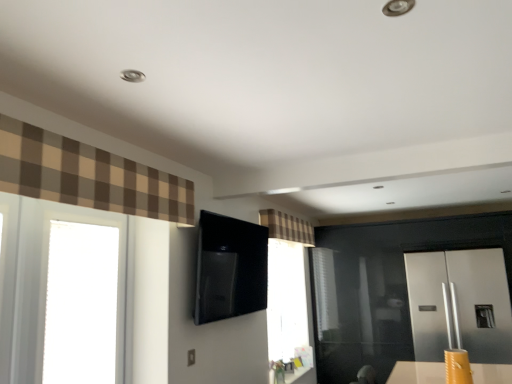
At what (x,y) coordinates should I click in order to perform the action: click on plaid fabric curtain at upper center, the first curtain in the right-to-left sequence. Please return your answer as a coordinate pair (x, y). The width and height of the screenshot is (512, 384). Looking at the image, I should click on (287, 227).

Find the location of a particular element. The width and height of the screenshot is (512, 384). matte black outlet at lower center is located at coordinates (191, 357).

What is the approximate width of brown plaid curtain at upper left, which is the second curtain in back-to-front order?

The width of brown plaid curtain at upper left, which is the second curtain in back-to-front order, is 6.51 inches.

You are a GUI agent. You are given a task and a screenshot of the screen. Output one action in this format:
    pyautogui.click(x=<x>, y=<y>)
    Task: Click on the transparent glass window at left
    Image resolution: width=512 pixels, height=384 pixels.
    Given the screenshot: What is the action you would take?
    pyautogui.click(x=81, y=304)

Based on the photo, considering the relative positions of transparent glass window at left and matte black outlet at lower center in the image provided, is transparent glass window at left to the left or to the right of matte black outlet at lower center?

Clearly, transparent glass window at left is on the left of matte black outlet at lower center in the image.

Is transparent glass window at left located outside matte black outlet at lower center?

Yes.

Looking at this image, from a real-world perspective, who is located lower, transparent glass window at left or matte black outlet at lower center?

From a 3D spatial view, matte black outlet at lower center is below.

Does transparent glass window at left appear on the left side of plaid fabric curtain at upper center, the first curtain in the right-to-left sequence?

Yes.

How many degrees apart are the facing directions of transparent glass window at left and plaid fabric curtain at upper center, placed as the first curtain when sorted from bottom to top?

They differ by 0.516 degrees in their facing directions.

Does transparent glass window at left lie behind plaid fabric curtain at upper center, acting as the second curtain starting from the top?

No, transparent glass window at left is closer to the viewer.

Can transparent glass window at left be found inside plaid fabric curtain at upper center, acting as the second curtain starting from the top?

No, plaid fabric curtain at upper center, acting as the second curtain starting from the top, does not contain transparent glass window at left.

Does plaid fabric curtain at upper center, acting as the second curtain starting from the top, lie in front of transparent glass window at left?

No, it is behind transparent glass window at left.

Can you confirm if plaid fabric curtain at upper center, acting as the second curtain starting from the top, is taller than transparent glass window at left?

Incorrect, the height of plaid fabric curtain at upper center, acting as the second curtain starting from the top, is not larger of that of transparent glass window at left.

Which object is positioned more to the left, plaid fabric curtain at upper center, the second curtain positioned from the left, or brown plaid curtain at upper left, which is counted as the first curtain, starting from the front?

From the viewer's perspective, brown plaid curtain at upper left, which is counted as the first curtain, starting from the front, appears more on the left side.

Does point (303, 240) lie behind point (85, 189)?

That is True.

Does plaid fabric curtain at upper center, the second curtain positioned from the left, contain brown plaid curtain at upper left, which is the second curtain in back-to-front order?

Actually, brown plaid curtain at upper left, which is the second curtain in back-to-front order, is outside plaid fabric curtain at upper center, the second curtain positioned from the left.

Where is `curtain below the plaid fabric curtain at upper center, the first curtain in the right-to-left sequence (from a real-world perspective)`? The height and width of the screenshot is (384, 512). curtain below the plaid fabric curtain at upper center, the first curtain in the right-to-left sequence (from a real-world perspective) is located at coordinates (87, 175).

Can you confirm if satin silver refrigerator at right is wider than plaid fabric curtain at upper center, placed as the first curtain when sorted from bottom to top?

Yes, satin silver refrigerator at right is wider than plaid fabric curtain at upper center, placed as the first curtain when sorted from bottom to top.

Is satin silver refrigerator at right next to plaid fabric curtain at upper center, the second curtain positioned from the left, and touching it?

No, satin silver refrigerator at right is not touching plaid fabric curtain at upper center, the second curtain positioned from the left.

Looking at this image, is satin silver refrigerator at right positioned beyond the bounds of plaid fabric curtain at upper center, the second curtain positioned from the left?

Yes, satin silver refrigerator at right is not within plaid fabric curtain at upper center, the second curtain positioned from the left.

How many degrees apart are the facing directions of satin silver refrigerator at right and plaid fabric curtain at upper center, which ranks as the first curtain in back-to-front order?

satin silver refrigerator at right and plaid fabric curtain at upper center, which ranks as the first curtain in back-to-front order, are facing 90.5 degrees away from each other.

Is matte black outlet at lower center facing towards brown plaid curtain at upper left, which is the second curtain in back-to-front order?

No, matte black outlet at lower center does not turn towards brown plaid curtain at upper left, which is the second curtain in back-to-front order.

In the scene shown: In terms of size, does matte black outlet at lower center appear bigger or smaller than brown plaid curtain at upper left, the first curtain viewed from the left?

matte black outlet at lower center is smaller than brown plaid curtain at upper left, the first curtain viewed from the left.

This screenshot has height=384, width=512. I want to click on electric outlet behind the brown plaid curtain at upper left, the first curtain viewed from the top, so click(x=191, y=357).

Could you tell me if brown plaid curtain at upper left, the first curtain viewed from the top, is turned towards plaid fabric curtain at upper center, which ranks as the first curtain in back-to-front order?

No, brown plaid curtain at upper left, the first curtain viewed from the top, is not turned towards plaid fabric curtain at upper center, which ranks as the first curtain in back-to-front order.

Is brown plaid curtain at upper left, which ranks as the second curtain in bottom-to-top order, wider than plaid fabric curtain at upper center, the first curtain in the right-to-left sequence?

In fact, brown plaid curtain at upper left, which ranks as the second curtain in bottom-to-top order, might be narrower than plaid fabric curtain at upper center, the first curtain in the right-to-left sequence.

From the picture: Is brown plaid curtain at upper left, the first curtain viewed from the top, next to plaid fabric curtain at upper center, acting as the second curtain starting from the top, and touching it?

A: No.

Who is taller, brown plaid curtain at upper left, which ranks as the second curtain in bottom-to-top order, or plaid fabric curtain at upper center, placed as the second curtain when sorted from front to back?

With more height is plaid fabric curtain at upper center, placed as the second curtain when sorted from front to back.

This screenshot has height=384, width=512. In the image, there is a transparent glass window at left. Identify the location of electric outlet below it (from the image's perspective). (191, 357).

Locate an element on the screen. This screenshot has height=384, width=512. curtain behind the transparent glass window at left is located at coordinates (287, 227).

Estimate the real-world distances between objects in this image. Which object is further from matte black outlet at lower center, transparent glass window at left or brown plaid curtain at upper left, the first curtain viewed from the top?

brown plaid curtain at upper left, the first curtain viewed from the top, is further to matte black outlet at lower center.

Considering their positions, is plaid fabric curtain at upper center, the first curtain in the right-to-left sequence, positioned further to brown plaid curtain at upper left, which is the 2th curtain in right-to-left order, than satin silver refrigerator at right?

Among the two, satin silver refrigerator at right is located further to brown plaid curtain at upper left, which is the 2th curtain in right-to-left order.

Looking at the image, which one is located closer to plaid fabric curtain at upper center, placed as the first curtain when sorted from bottom to top, brown plaid curtain at upper left, the first curtain viewed from the top, or matte black outlet at lower center?

matte black outlet at lower center is positioned closer to the anchor plaid fabric curtain at upper center, placed as the first curtain when sorted from bottom to top.

Considering their positions, is transparent glass window at left positioned closer to brown plaid curtain at upper left, which is the 2th curtain in right-to-left order, than matte black outlet at lower center?

transparent glass window at left is positioned closer to the anchor brown plaid curtain at upper left, which is the 2th curtain in right-to-left order.

Looking at the image, which one is located closer to transparent glass window at left, matte black outlet at lower center or plaid fabric curtain at upper center, placed as the second curtain when sorted from front to back?

matte black outlet at lower center is closer to transparent glass window at left.

When comparing their distances from transparent glass window at left, does brown plaid curtain at upper left, the first curtain viewed from the left, or matte black outlet at lower center seem further?

matte black outlet at lower center is further to transparent glass window at left.

Based on their spatial positions, is plaid fabric curtain at upper center, placed as the second curtain when sorted from front to back, or satin silver refrigerator at right closer to matte black outlet at lower center?

plaid fabric curtain at upper center, placed as the second curtain when sorted from front to back.

When comparing their distances from transparent glass window at left, does plaid fabric curtain at upper center, the second curtain positioned from the left, or matte black outlet at lower center seem closer?

matte black outlet at lower center is closer to transparent glass window at left.

The width and height of the screenshot is (512, 384). In order to click on curtain between matte black outlet at lower center and satin silver refrigerator at right in this screenshot , I will do `click(287, 227)`.

At what (x,y) coordinates should I click in order to perform the action: click on electric outlet between transparent glass window at left and plaid fabric curtain at upper center, placed as the first curtain when sorted from bottom to top, in the front-back direction. Please return your answer as a coordinate pair (x, y). The width and height of the screenshot is (512, 384). Looking at the image, I should click on (191, 357).

Find the location of a particular element. This screenshot has width=512, height=384. window located between brown plaid curtain at upper left, which is counted as the first curtain, starting from the front, and plaid fabric curtain at upper center, placed as the first curtain when sorted from bottom to top, in the depth direction is located at coordinates (81, 304).

At what (x,y) coordinates should I click in order to perform the action: click on electric outlet between brown plaid curtain at upper left, the first curtain viewed from the top, and plaid fabric curtain at upper center, acting as the second curtain starting from the top, from front to back. Please return your answer as a coordinate pair (x, y). Looking at the image, I should click on (191, 357).